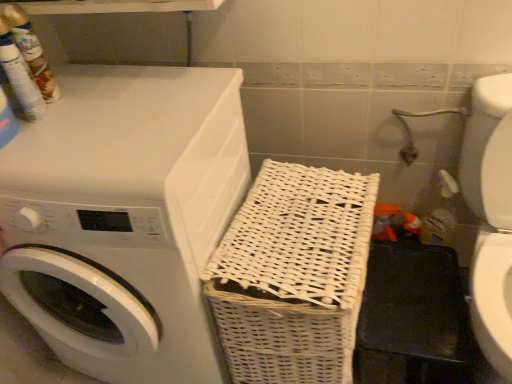
The image size is (512, 384). Identify the location of free point above white matte/woven laundry basket at right (from a real-world perspective). (90, 117).